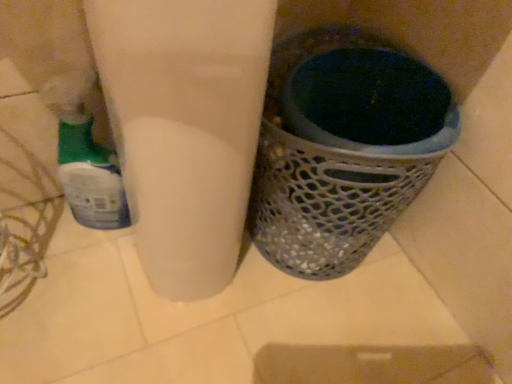
At what (x,y) coordinates should I click in order to perform the action: click on metallic mesh waste bin at lower right. Please return your answer as a coordinate pair (x, y). The image size is (512, 384). Looking at the image, I should click on (343, 147).

Describe the element at coordinates (343, 147) in the screenshot. I see `metallic mesh waste bin at lower right` at that location.

Locate an element on the screen. metallic mesh waste bin at lower right is located at coordinates (343, 147).